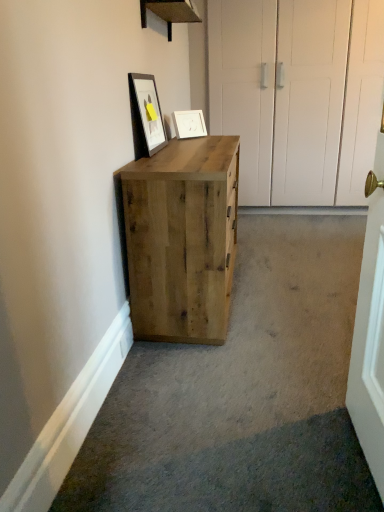
Question: From the image's perspective, does white matte picture frame at upper center, the 1th picture frame from the back, appear lower than matte black picture frame at upper center, acting as the first picture frame starting from the front?

Choices:
 (A) no
 (B) yes

Answer: (A)

Question: Is white matte picture frame at upper center, the 1th picture frame from the back, thinner than matte black picture frame at upper center, which is the first picture frame from left to right?

Choices:
 (A) yes
 (B) no

Answer: (B)

Question: Is white matte picture frame at upper center, the 2th picture frame in the front-to-back sequence, taller than matte black picture frame at upper center, the second picture frame from the back?

Choices:
 (A) no
 (B) yes

Answer: (A)

Question: Is the position of white matte picture frame at upper center, the 1th picture frame positioned from the right, more distant than that of matte black picture frame at upper center, the second picture frame from the back?

Choices:
 (A) yes
 (B) no

Answer: (A)

Question: Considering the relative sizes of white matte picture frame at upper center, the 1th picture frame from the back, and matte black picture frame at upper center, which is the first picture frame from left to right, in the image provided, is white matte picture frame at upper center, the 1th picture frame from the back, smaller than matte black picture frame at upper center, which is the first picture frame from left to right,?

Choices:
 (A) no
 (B) yes

Answer: (B)

Question: Considering the positions of matte black picture frame at upper center, the second picture frame viewed from the right, and white matte picture frame at upper center, the 2th picture frame in the front-to-back sequence, in the image, is matte black picture frame at upper center, the second picture frame viewed from the right, taller or shorter than white matte picture frame at upper center, the 2th picture frame in the front-to-back sequence,?

Choices:
 (A) short
 (B) tall

Answer: (B)

Question: Is matte black picture frame at upper center, which is the first picture frame from left to right, in front of or behind white matte picture frame at upper center, the second picture frame viewed from the left, in the image?

Choices:
 (A) behind
 (B) front

Answer: (B)

Question: From the image's perspective, relative to white matte picture frame at upper center, the second picture frame viewed from the left, is matte black picture frame at upper center, the second picture frame viewed from the right, above or below?

Choices:
 (A) above
 (B) below

Answer: (B)

Question: Choose the correct answer: Is matte black picture frame at upper center, the second picture frame viewed from the right, inside white matte picture frame at upper center, the 1th picture frame from the back, or outside it?

Choices:
 (A) outside
 (B) inside

Answer: (A)

Question: Is white matte picture frame at upper center, the 2th picture frame in the front-to-back sequence, spatially inside matte black picture frame at upper center, the second picture frame viewed from the right, or outside of it?

Choices:
 (A) inside
 (B) outside

Answer: (B)

Question: Based on their positions, is white matte picture frame at upper center, the 1th picture frame from the back, located to the left or right of matte black picture frame at upper center, which is the first picture frame from left to right?

Choices:
 (A) left
 (B) right

Answer: (B)

Question: In terms of width, does white matte picture frame at upper center, the second picture frame viewed from the left, look wider or thinner when compared to matte black picture frame at upper center, the second picture frame viewed from the right?

Choices:
 (A) wide
 (B) thin

Answer: (A)

Question: Relative to matte black picture frame at upper center, the second picture frame viewed from the right, is white matte picture frame at upper center, the 2th picture frame in the front-to-back sequence, in front or behind?

Choices:
 (A) behind
 (B) front

Answer: (A)

Question: Is natural wood cabinet at center taller or shorter than matte black picture frame at upper center, the second picture frame from the back?

Choices:
 (A) short
 (B) tall

Answer: (B)

Question: Is point (160, 225) closer or farther from the camera than point (135, 97)?

Choices:
 (A) closer
 (B) farther

Answer: (A)